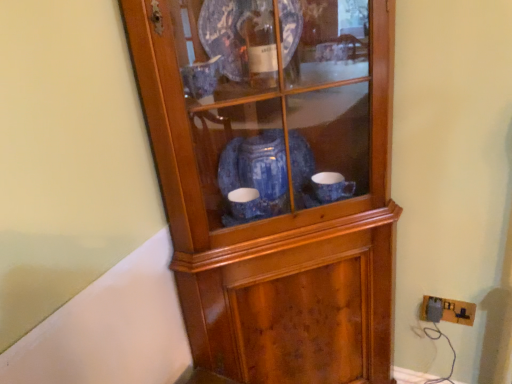
Question: From the image's perspective, is wooden cupboard at center beneath brown cardboard electric outlet at lower right?

Choices:
 (A) yes
 (B) no

Answer: (B)

Question: From a real-world perspective, is wooden cupboard at center beneath brown cardboard electric outlet at lower right?

Choices:
 (A) yes
 (B) no

Answer: (B)

Question: Is wooden cupboard at center with brown cardboard electric outlet at lower right?

Choices:
 (A) yes
 (B) no

Answer: (B)

Question: Can you confirm if wooden cupboard at center is smaller than brown cardboard electric outlet at lower right?

Choices:
 (A) yes
 (B) no

Answer: (B)

Question: Is wooden cupboard at center surrounding brown cardboard electric outlet at lower right?

Choices:
 (A) no
 (B) yes

Answer: (A)

Question: From the image's perspective, does wooden cupboard at center appear higher than brown cardboard electric outlet at lower right?

Choices:
 (A) no
 (B) yes

Answer: (B)

Question: Is brown cardboard electric outlet at lower right shorter than wooden cupboard at center?

Choices:
 (A) no
 (B) yes

Answer: (B)

Question: Would you consider brown cardboard electric outlet at lower right to be distant from wooden cupboard at center?

Choices:
 (A) yes
 (B) no

Answer: (B)

Question: Is brown cardboard electric outlet at lower right directly adjacent to wooden cupboard at center?

Choices:
 (A) no
 (B) yes

Answer: (A)

Question: Does brown cardboard electric outlet at lower right have a greater width compared to wooden cupboard at center?

Choices:
 (A) no
 (B) yes

Answer: (A)

Question: Considering the relative sizes of brown cardboard electric outlet at lower right and wooden cupboard at center in the image provided, is brown cardboard electric outlet at lower right thinner than wooden cupboard at center?

Choices:
 (A) yes
 (B) no

Answer: (A)

Question: Is brown cardboard electric outlet at lower right to the left of wooden cupboard at center from the viewer's perspective?

Choices:
 (A) no
 (B) yes

Answer: (A)

Question: From a real-world perspective, is wooden cupboard at center physically located above or below brown cardboard electric outlet at lower right?

Choices:
 (A) below
 (B) above

Answer: (B)